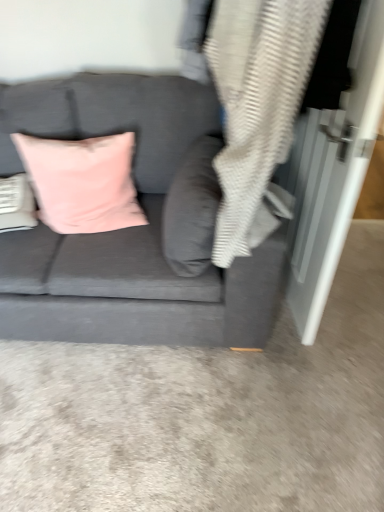
Question: Should I look upward or downward to see velvet pink pillow at center, arranged as the 2th pillow when viewed from the left?

Choices:
 (A) down
 (B) up

Answer: (B)

Question: Should I look upward or downward to see pink velvet cushion at upper left, positioned as the first pillow in left-to-right order?

Choices:
 (A) down
 (B) up

Answer: (B)

Question: Is pink velvet cushion at upper left, which ranks as the second pillow in right-to-left order, behind velvet pink pillow at center, arranged as the 2th pillow when viewed from the left?

Choices:
 (A) no
 (B) yes

Answer: (B)

Question: Can you confirm if pink velvet cushion at upper left, which ranks as the second pillow in right-to-left order, is thinner than velvet pink pillow at center, arranged as the 2th pillow when viewed from the left?

Choices:
 (A) no
 (B) yes

Answer: (A)

Question: Does pink velvet cushion at upper left, which ranks as the second pillow in right-to-left order, appear on the left side of velvet pink pillow at center, marked as the first pillow in a right-to-left arrangement?

Choices:
 (A) yes
 (B) no

Answer: (A)

Question: From a real-world perspective, is pink velvet cushion at upper left, positioned as the first pillow in left-to-right order, over velvet pink pillow at center, marked as the first pillow in a right-to-left arrangement?

Choices:
 (A) yes
 (B) no

Answer: (B)

Question: Considering the relative positions of pink velvet cushion at upper left, positioned as the first pillow in left-to-right order, and velvet pink pillow at center, marked as the first pillow in a right-to-left arrangement, in the image provided, is pink velvet cushion at upper left, positioned as the first pillow in left-to-right order, to the right of velvet pink pillow at center, marked as the first pillow in a right-to-left arrangement, from the viewer's perspective?

Choices:
 (A) yes
 (B) no

Answer: (B)

Question: Is pink velvet cushion at upper left, which ranks as the second pillow in right-to-left order, outside velvet pink pillow at center, marked as the first pillow in a right-to-left arrangement?

Choices:
 (A) no
 (B) yes

Answer: (B)

Question: Is gray textured blanket at upper right thinner than velvet gray couch at center?

Choices:
 (A) yes
 (B) no

Answer: (A)

Question: From the image's perspective, is gray textured blanket at upper right on velvet gray couch at center?

Choices:
 (A) no
 (B) yes

Answer: (B)

Question: Considering the relative positions of gray textured blanket at upper right and velvet gray couch at center in the image provided, is gray textured blanket at upper right in front of velvet gray couch at center?

Choices:
 (A) yes
 (B) no

Answer: (A)

Question: Is gray textured blanket at upper right oriented towards velvet gray couch at center?

Choices:
 (A) yes
 (B) no

Answer: (A)

Question: From the image's perspective, is gray textured blanket at upper right beneath velvet gray couch at center?

Choices:
 (A) no
 (B) yes

Answer: (A)

Question: Is gray textured blanket at upper right surrounding velvet gray couch at center?

Choices:
 (A) no
 (B) yes

Answer: (A)

Question: Is velvet pink pillow at center, marked as the first pillow in a right-to-left arrangement, positioned before pink velvet cushion at upper left, which ranks as the second pillow in right-to-left order?

Choices:
 (A) no
 (B) yes

Answer: (B)